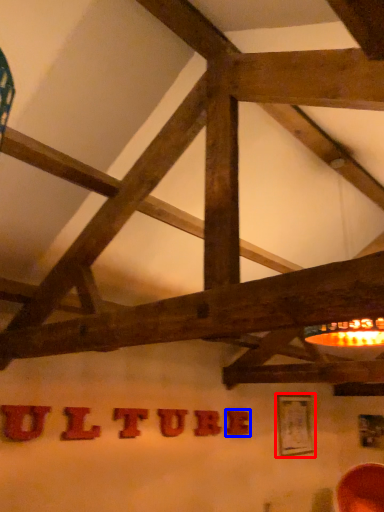
Question: Which point is further to the camera, picture frame (highlighted by a red box) or letter (highlighted by a blue box)?

Choices:
 (A) picture frame
 (B) letter

Answer: (A)